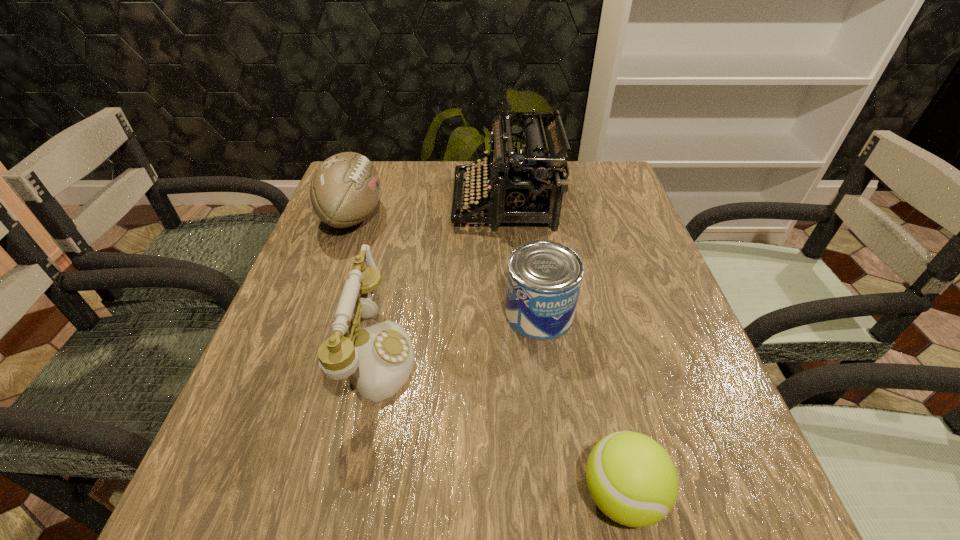
Where is `the tallest object`? The width and height of the screenshot is (960, 540). the tallest object is located at coordinates (532, 181).

You are a GUI agent. You are given a task and a screenshot of the screen. Output one action in this format:
    pyautogui.click(x=<x>, y=<y>)
    Task: Click on the telephone
    
    Given the screenshot: What is the action you would take?
    pyautogui.click(x=378, y=360)

This screenshot has height=540, width=960. Identify the location of football (American). (345, 189).

Find the location of `can`. can is located at coordinates pos(544,278).

You are a GUI agent. You are given a task and a screenshot of the screen. Output one action in this format:
    pyautogui.click(x=<x>, y=<y>)
    Task: Click on the vacant space located 0.080m on the typing side of the typewriter
    Image resolution: width=960 pixels, height=540 pixels.
    Given the screenshot: What is the action you would take?
    pyautogui.click(x=423, y=201)

At what (x,y) coordinates should I click in order to perform the action: click on free region located on the typing side of the typewriter. Please return your answer as a coordinate pair (x, y). The height and width of the screenshot is (540, 960). Looking at the image, I should click on 349,201.

You are a GUI agent. You are given a task and a screenshot of the screen. Output one action in this format:
    pyautogui.click(x=<x>, y=<y>)
    Task: Click on the vacant space located 0.330m on the typing side of the typewriter
    Image resolution: width=960 pixels, height=540 pixels.
    Given the screenshot: What is the action you would take?
    pyautogui.click(x=330, y=201)

Image resolution: width=960 pixels, height=540 pixels. Find the location of `free space located on the dial of the telephone`. free space located on the dial of the telephone is located at coordinates (607, 355).

Identify the location of free spot located 0.270m on the laces of the football (American). (489, 216).

The height and width of the screenshot is (540, 960). Find the location of `free space located 0.210m on the front label of the can`. free space located 0.210m on the front label of the can is located at coordinates (557, 448).